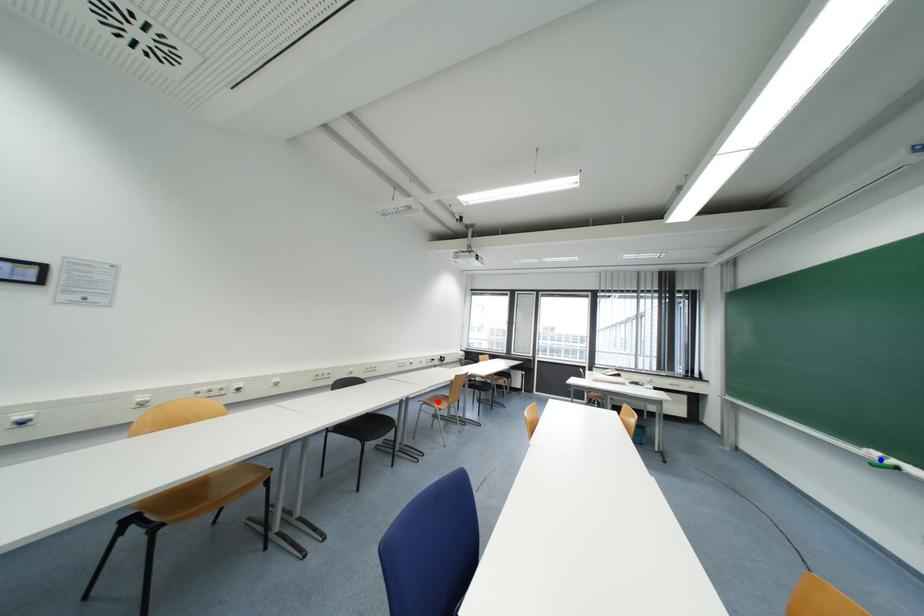
Question: Which of the two points in the image is closer to the camera?

Choices:
 (A) Blue point is closer.
 (B) Red point is closer.

Answer: (A)